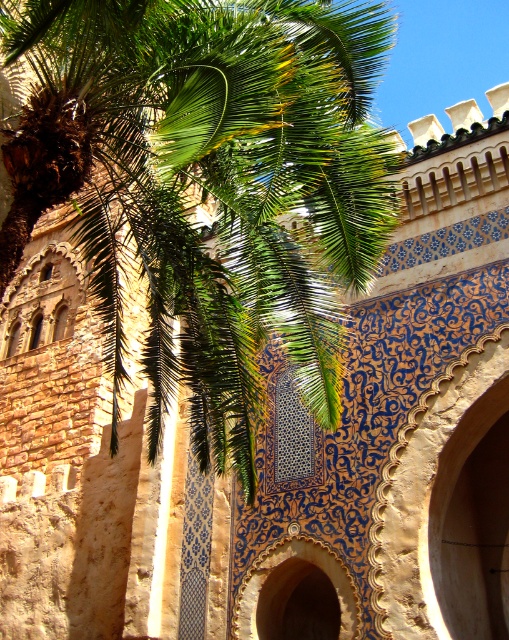
Between green leafy palm at upper left and blue glazed tile archway at center, which one appears on the left side from the viewer's perspective?

Positioned to the left is green leafy palm at upper left.

Does point (195, 22) lie behind point (353, 611)?

No, it is not.

Is point (240, 154) positioned before point (325, 612)?

Yes.

You are a GUI agent. You are given a task and a screenshot of the screen. Output one action in this format:
    pyautogui.click(x=<x>, y=<y>)
    Task: Click on the green leafy palm at upper left
    Image resolution: width=509 pixels, height=640 pixels.
    Given the screenshot: What is the action you would take?
    pyautogui.click(x=218, y=186)